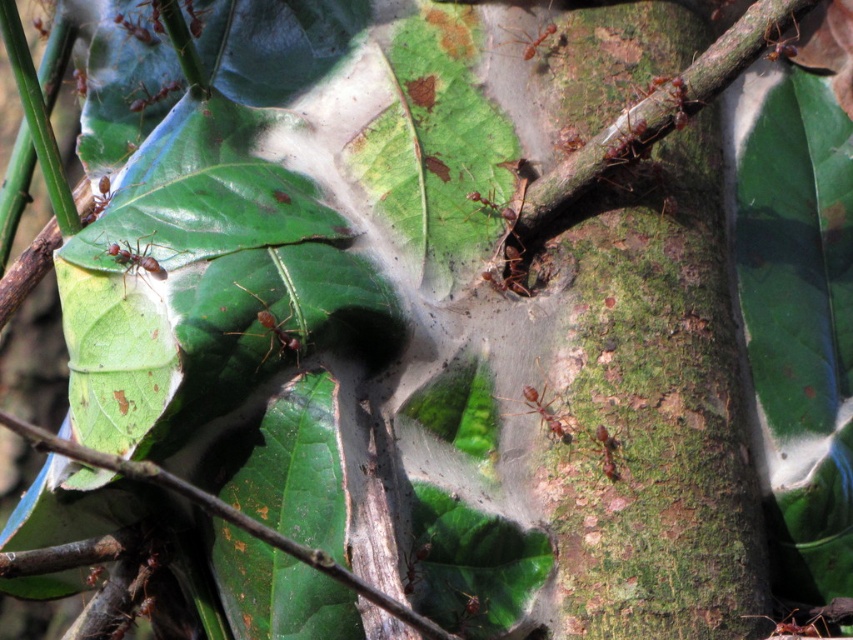
Question: Does brown matte ant at center-left appear on the left side of brown matte ant at center?

Choices:
 (A) no
 (B) yes

Answer: (B)

Question: Which object is farther from the camera taking this photo?

Choices:
 (A) brown rough twig at center
 (B) red matte ant at upper center

Answer: (B)

Question: Which point is farther to the camera?

Choices:
 (A) matte brown ant at upper left
 (B) brown glossy ant at center
 (C) brown matte ant at center-left
 (D) brown rough twig at center

Answer: (A)

Question: Where is shiny brown ant at center located in relation to brown matte ant at center in the image?

Choices:
 (A) right
 (B) left

Answer: (B)

Question: Is green rough bark at right wider than red matte ant at upper center?

Choices:
 (A) no
 (B) yes

Answer: (B)

Question: Based on their relative distances, which object is farther from the shiny brown ant at center?

Choices:
 (A) brown matte ant at center
 (B) matte brown ant at upper left
 (C) red matte ant at upper center

Answer: (C)